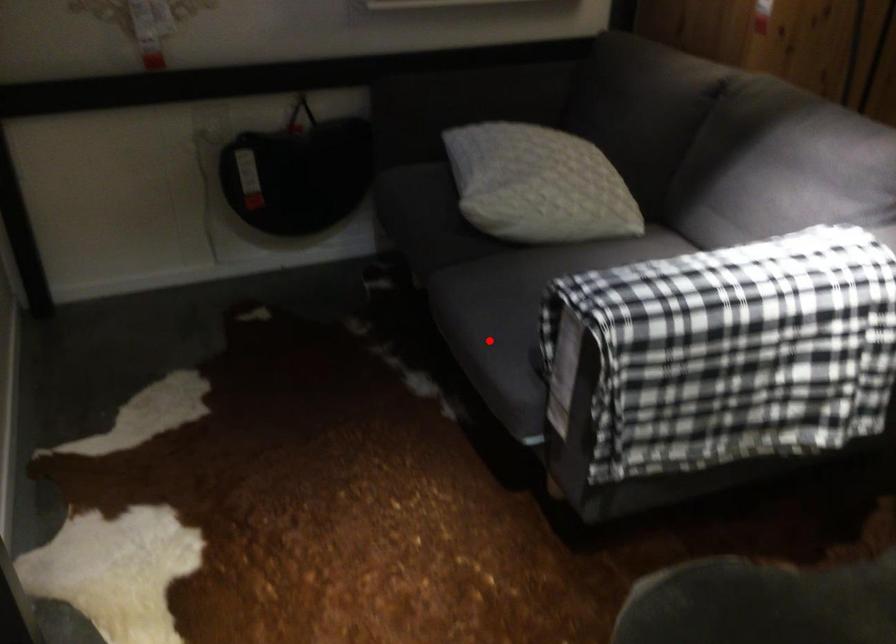
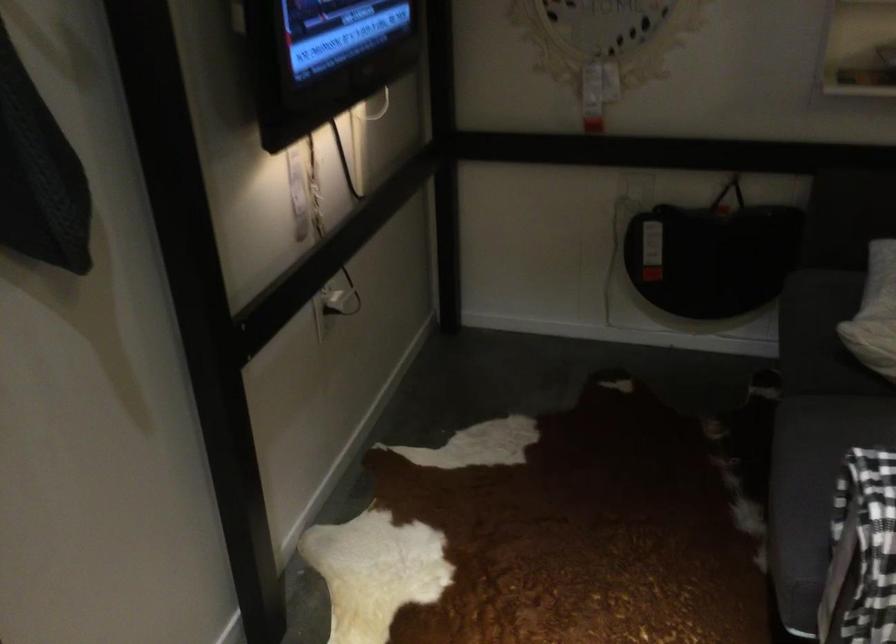
The point at the highlighted location is marked in the first image. Where is the corresponding point in the second image?

(805, 494)